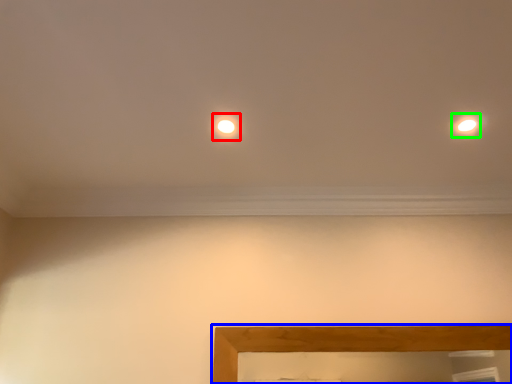
Question: Considering the real-world distances, which object is farthest from glow (highlighted by a red box)? picture frame (highlighted by a blue box) or light (highlighted by a green box)?

Choices:
 (A) picture frame
 (B) light

Answer: (A)